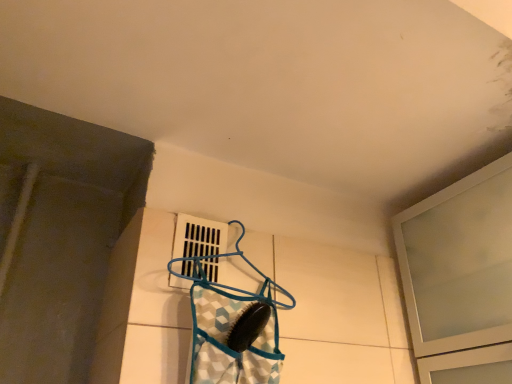
Question: From the image's perspective, relative to frosted glass cabinet at upper right, the first window viewed from the right, is blue plastic hanger at center above or below?

Choices:
 (A) below
 (B) above

Answer: (B)

Question: Considering the positions of blue plastic hanger at center and frosted glass cabinet at upper right, the first window viewed from the right, in the image, is blue plastic hanger at center wider or thinner than frosted glass cabinet at upper right, the first window viewed from the right,?

Choices:
 (A) wide
 (B) thin

Answer: (B)

Question: Estimate the real-world distances between objects in this image. Which object is closer to the blue fabric bag at center?

Choices:
 (A) blue plastic hanger at center
 (B) frosted glass cabinet at upper right, the second window when ordered from left to right
 (C) white plastic vent at center, the 1th window viewed from the left

Answer: (A)

Question: Which object is the closest to the white plastic vent at center, which is the 2th window in right-to-left order?

Choices:
 (A) blue plastic hanger at center
 (B) blue fabric bag at center
 (C) frosted glass cabinet at upper right, the first window viewed from the right

Answer: (A)